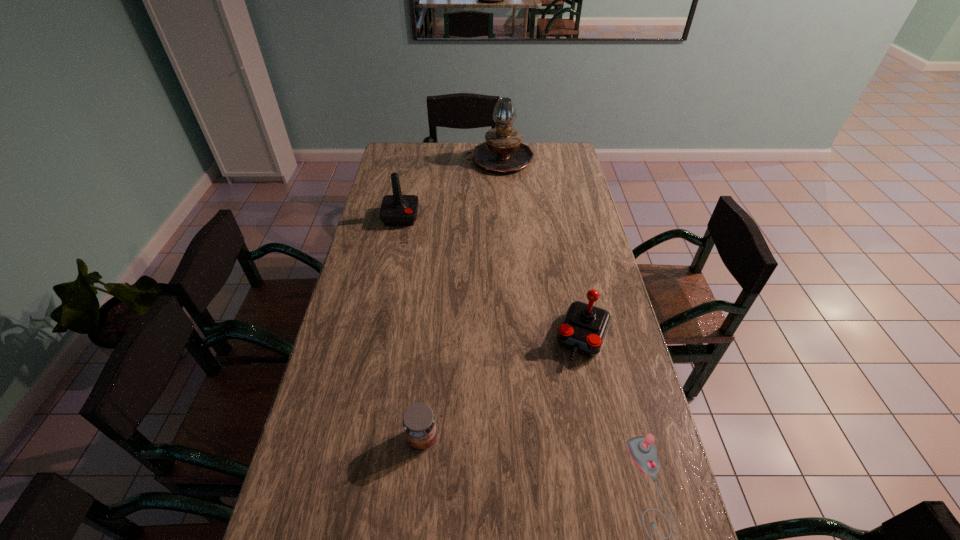
Locate an element on the screen. This screenshot has width=960, height=540. the farthest object is located at coordinates (502, 152).

Where is `oil lamp`? The width and height of the screenshot is (960, 540). oil lamp is located at coordinates (502, 152).

Locate an element on the screen. This screenshot has height=540, width=960. the leftmost object is located at coordinates (396, 210).

Where is `the farthest joystick`? the farthest joystick is located at coordinates (396, 210).

At what (x,y) coordinates should I click in order to perform the action: click on the third farthest object. Please return your answer as a coordinate pair (x, y). Image resolution: width=960 pixels, height=540 pixels. Looking at the image, I should click on (584, 327).

Locate an element on the screen. The width and height of the screenshot is (960, 540). jam is located at coordinates click(419, 424).

Identify the location of the fourth object from right to left. The height and width of the screenshot is (540, 960). (419, 424).

Locate an element on the screen. Image resolution: width=960 pixels, height=540 pixels. free spot located 0.060m on the left of the tallest object is located at coordinates (453, 159).

Locate an element on the screen. This screenshot has height=540, width=960. free location located on the right of the second farthest object is located at coordinates (505, 217).

At what (x,y) coordinates should I click in order to perform the action: click on vacant space situated on the left of the second nearest joystick. Please return your answer as a coordinate pair (x, y). Looking at the image, I should click on (528, 338).